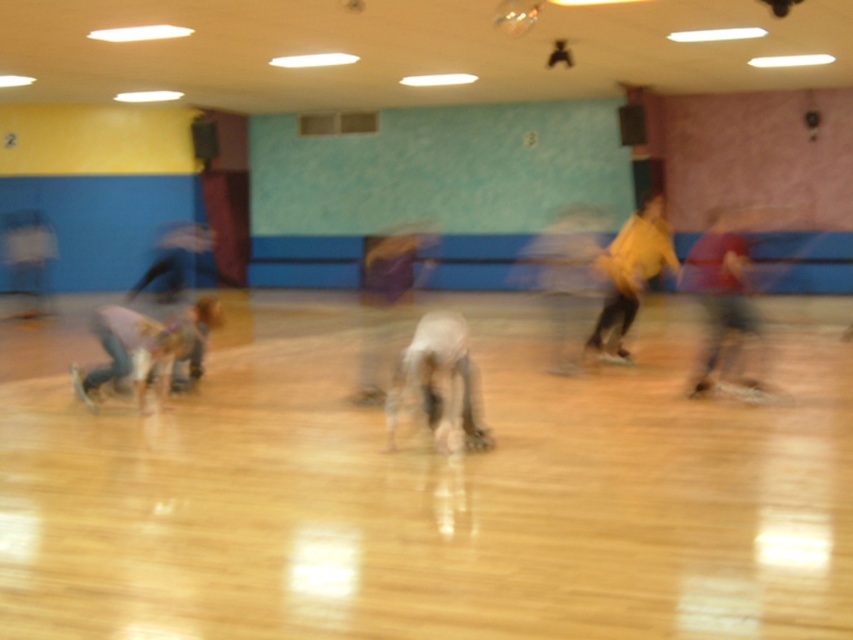
You are standing at the entrance of the roller skating rink and notice two people in the scene. One is the white matte person at center and the other is the light blue jeans at lower left. Which of these two individuals appears taller in the image?

The light blue jeans at lower left appears taller than the white matte person at center.

What are the coordinates of the white matte person at center?

The white matte person at center is located at coordinates point (x=437, y=381).